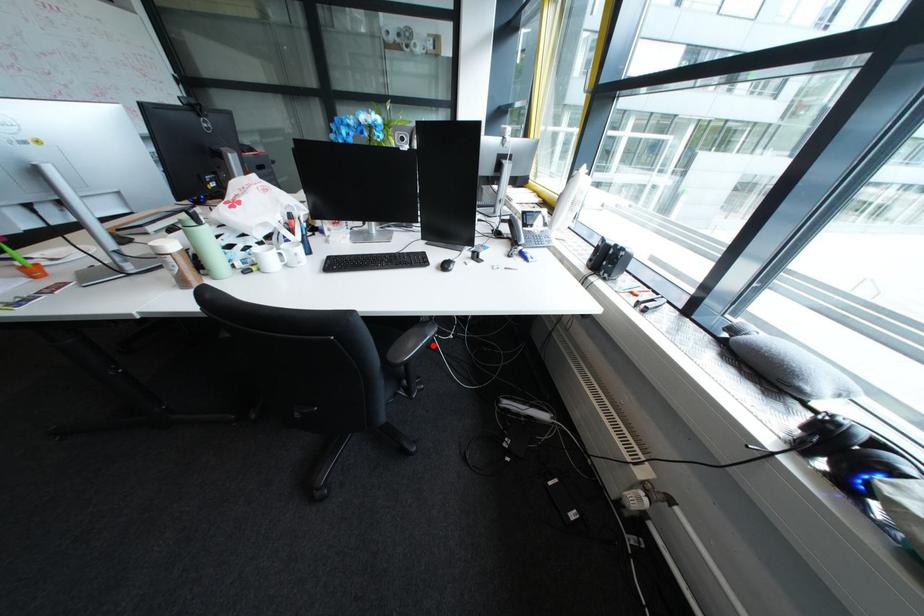
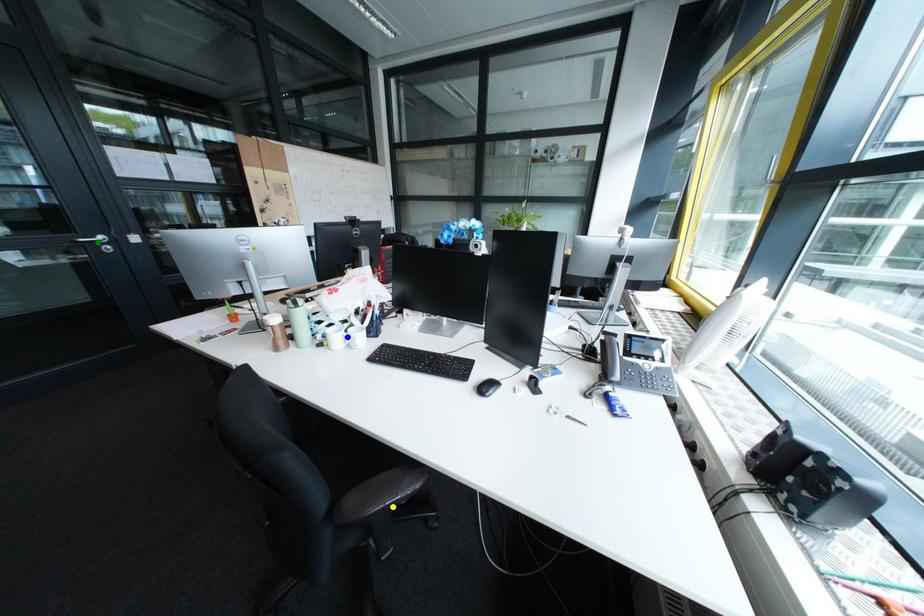
Question: I am providing you with two images of the same scene from different viewpoints. A red point is marked on the first image. You are given multiple points on the second image. Which mark in image 2 goes with the point in image 1?

Choices:
 (A) yellow point
 (B) green point
 (C) blue point

Answer: (A)